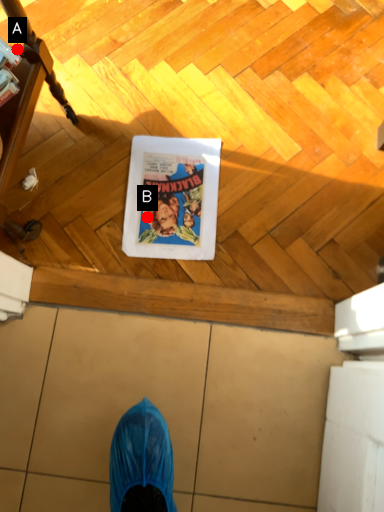
Question: Two points are circled on the image, labeled by A and B beside each circle. Which point appears farthest from the camera in this image?

Choices:
 (A) A is further
 (B) B is further

Answer: (B)